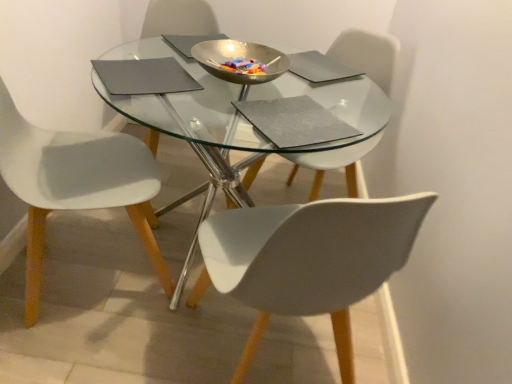
Question: Does point (276, 231) appear closer or farther from the camera than point (216, 24)?

Choices:
 (A) farther
 (B) closer

Answer: (B)

Question: From the image's perspective, is white plastic chair at lower right, the 2th chair viewed from the left, positioned above or below transparent glass bowl at center?

Choices:
 (A) below
 (B) above

Answer: (A)

Question: Estimate the real-world distances between objects in this image. Which object is farther from the metallic gold bowl at center?

Choices:
 (A) matte gray pad at upper left
 (B) transparent glass bowl at center
 (C) white matte chair at lower left, which is the first chair from left to right
 (D) transparent glass table at center
 (E) white plastic chair at lower right, which is the second chair in right-to-left order

Answer: (B)

Question: Which is farther from the white matte chair at lower left, the 3th chair positioned from the right?

Choices:
 (A) transparent glass table at center
 (B) white plastic chair at lower right, which is the second chair in right-to-left order
 (C) metallic gold bowl at center
 (D) matte gray pad at upper left
 (E) white plastic chair at center, which ranks as the 1th chair in right-to-left order

Answer: (E)